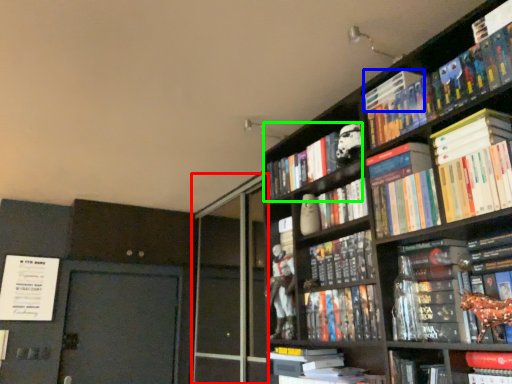
Question: Based on their relative distances, which object is farther from screen door (highlighted by a red box)? Choose from book (highlighted by a blue box) and book (highlighted by a green box).

Choices:
 (A) book
 (B) book

Answer: (A)